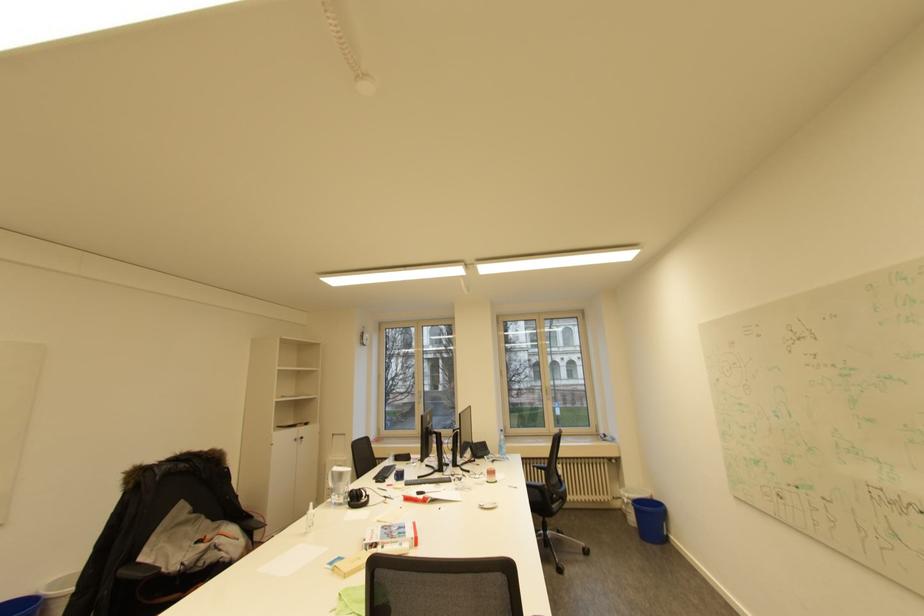
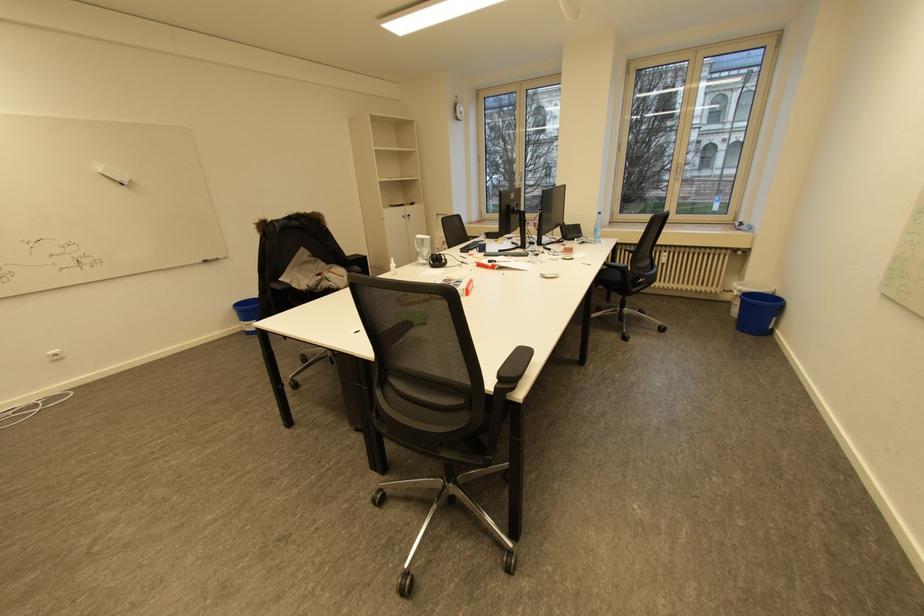
First-person continuous shooting, in which direction is the camera rotating?

The rotation direction of the camera is left-down.